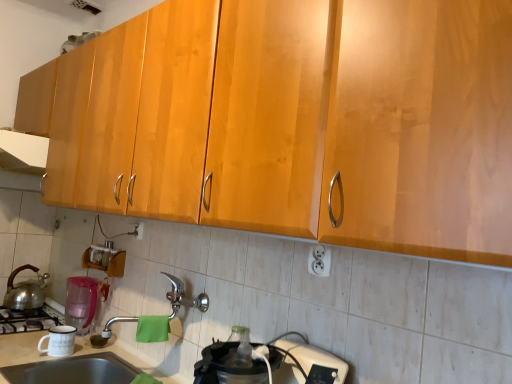
Question: From a real-world perspective, is white plastic outlet at lower center, acting as the first electric outlet starting from the front, physically below silver metallic faucet at center?

Choices:
 (A) yes
 (B) no

Answer: (B)

Question: Does white plastic outlet at lower center, acting as the 1th electric outlet starting from the right, appear on the left side of silver metallic faucet at center?

Choices:
 (A) no
 (B) yes

Answer: (A)

Question: Is white plastic outlet at lower center, acting as the first electric outlet starting from the front, positioned beyond the bounds of silver metallic faucet at center?

Choices:
 (A) no
 (B) yes

Answer: (B)

Question: Could you tell me if white plastic outlet at lower center, acting as the 2th electric outlet starting from the left, is turned towards silver metallic faucet at center?

Choices:
 (A) yes
 (B) no

Answer: (B)

Question: Would you say white plastic outlet at lower center, the second electric outlet from the back, contains silver metallic faucet at center?

Choices:
 (A) yes
 (B) no

Answer: (B)

Question: From their relative heights in the image, would you say white plastic outlet at lower center, the second electric outlet from the back, is taller or shorter than white glossy exhaust hood at upper left?

Choices:
 (A) short
 (B) tall

Answer: (A)

Question: Considering the positions of white plastic outlet at lower center, acting as the 2th electric outlet starting from the left, and white glossy exhaust hood at upper left in the image, is white plastic outlet at lower center, acting as the 2th electric outlet starting from the left, wider or thinner than white glossy exhaust hood at upper left?

Choices:
 (A) thin
 (B) wide

Answer: (A)

Question: Based on their positions, is white plastic outlet at lower center, acting as the first electric outlet starting from the front, located to the left or right of white glossy exhaust hood at upper left?

Choices:
 (A) left
 (B) right

Answer: (B)

Question: Is white plastic outlet at lower center, acting as the 2th electric outlet starting from the left, situated inside white glossy exhaust hood at upper left or outside?

Choices:
 (A) outside
 (B) inside

Answer: (A)

Question: In terms of height, does white plastic outlet at lower center, acting as the 1th electric outlet starting from the right, look taller or shorter compared to white plastic electric outlet at center, placed as the second electric outlet when sorted from front to back?

Choices:
 (A) short
 (B) tall

Answer: (A)

Question: Does point (320, 269) appear closer or farther from the camera than point (138, 231)?

Choices:
 (A) farther
 (B) closer

Answer: (B)

Question: Do you think white plastic outlet at lower center, the second electric outlet from the back, is within white plastic electric outlet at center, arranged as the 1th electric outlet when viewed from the left, or outside of it?

Choices:
 (A) inside
 (B) outside

Answer: (B)

Question: From a real-world perspective, relative to white plastic electric outlet at center, the 1th electric outlet positioned from the back, is white plastic outlet at lower center, acting as the 2th electric outlet starting from the left, vertically above or below?

Choices:
 (A) above
 (B) below

Answer: (A)

Question: Considering their positions, is silver metallic faucet at center located in front of or behind matte stainless steel sink at lower left?

Choices:
 (A) front
 (B) behind

Answer: (B)

Question: Is point (188, 304) positioned closer to the camera than point (128, 364)?

Choices:
 (A) farther
 (B) closer

Answer: (B)